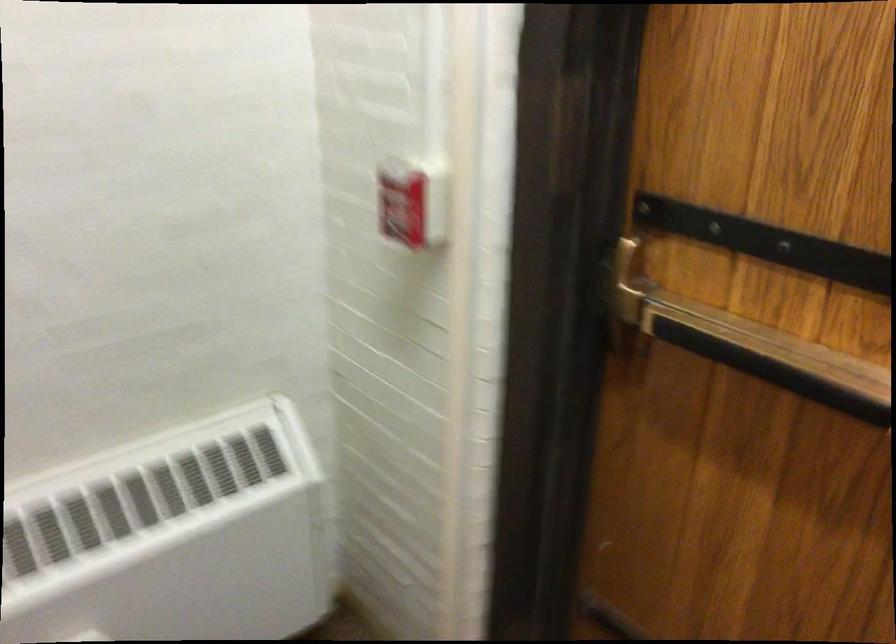
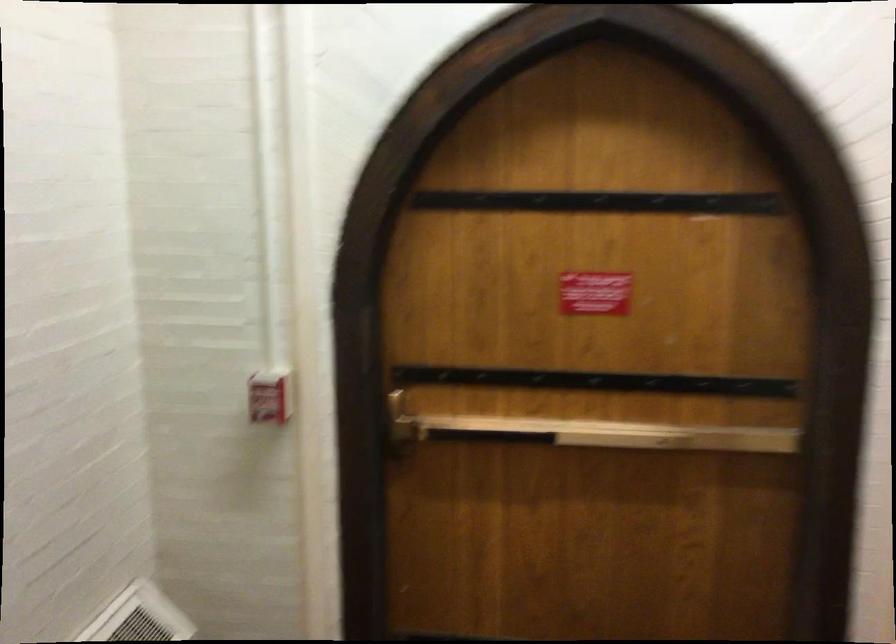
The point at (401, 202) is marked in the first image. Where is the corresponding point in the second image?

(270, 395)